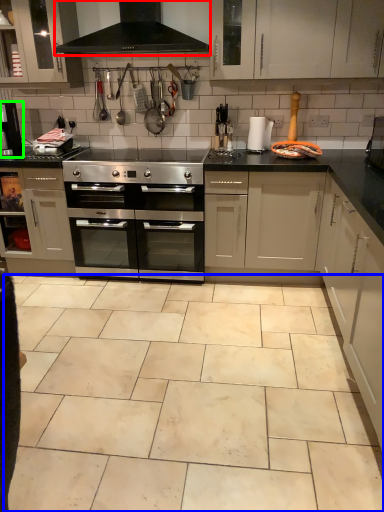
Question: Which object is positioned farthest from exhaust hood (highlighted by a red box)? Select from ceramic tile (highlighted by a blue box) and coffee machine (highlighted by a green box).

Choices:
 (A) ceramic tile
 (B) coffee machine

Answer: (A)